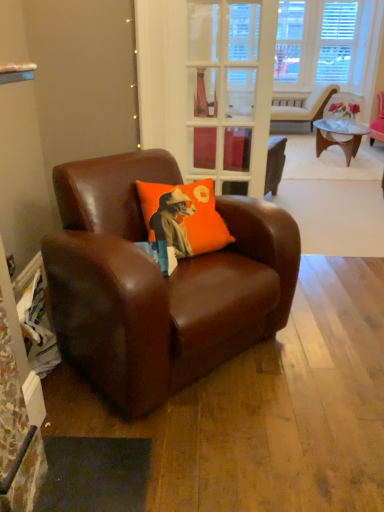
The width and height of the screenshot is (384, 512). What do you see at coordinates (303, 106) in the screenshot? I see `matte brown armchair at upper right, which appears as the first chair when viewed from the back` at bounding box center [303, 106].

The width and height of the screenshot is (384, 512). Describe the element at coordinates (158, 283) in the screenshot. I see `brown leather chair at left, arranged as the first chair when viewed from the left` at that location.

Image resolution: width=384 pixels, height=512 pixels. Find the location of `brown leather chair at left, which ranks as the first chair in bottom-to-top order`. brown leather chair at left, which ranks as the first chair in bottom-to-top order is located at coordinates (158, 283).

Find the location of a particular element. The image size is (384, 512). clear glass door at center is located at coordinates (230, 90).

The width and height of the screenshot is (384, 512). What are the coordinates of `matte brown armchair at upper right, the 2th chair viewed from the left` in the screenshot? It's located at (303, 106).

Identify the location of pillow that is on the left side of matte brown armchair at upper right, positioned as the 2th chair in front-to-back order. The height and width of the screenshot is (512, 384). (183, 217).

Between matte brown armchair at upper right, the 2th chair viewed from the left, and orange fabric pillow at center, which one has smaller size?

orange fabric pillow at center is smaller.

Can you confirm if matte brown armchair at upper right, which is counted as the first chair, starting from the top, is shorter than orange fabric pillow at center?

No, matte brown armchair at upper right, which is counted as the first chair, starting from the top, is not shorter than orange fabric pillow at center.

Can you tell me how much matte brown armchair at upper right, which is counted as the first chair, starting from the top, and orange fabric pillow at center differ in facing direction?

12.7 degrees.

Considering the sizes of brown leather chair at left, which is the second chair from right to left, and clear glass door at center in the image, is brown leather chair at left, which is the second chair from right to left, bigger or smaller than clear glass door at center?

In the image, brown leather chair at left, which is the second chair from right to left, appears to be larger than clear glass door at center.

From a real-world perspective, between brown leather chair at left, the second chair in the top-to-bottom sequence, and clear glass door at center, who is vertically lower?

brown leather chair at left, the second chair in the top-to-bottom sequence, from a real-world perspective.

What's the angular difference between brown leather chair at left, arranged as the first chair when viewed from the left, and clear glass door at center's facing directions?

They differ by 44.5 degrees in their facing directions.

From the picture: Is matte brown armchair at upper right, which is counted as the first chair, starting from the right, oriented away from clear glass door at center?

Answer: matte brown armchair at upper right, which is counted as the first chair, starting from the right, does not have its back to clear glass door at center.

From a real-world perspective, count 1st chairs downward from the clear glass door at center and point to it. Please provide its 2D coordinates.

[(303, 106)]

Based on the photo, which is in front, matte brown armchair at upper right, which is counted as the first chair, starting from the right, or clear glass door at center?

clear glass door at center is closer to the camera.

Does matte brown armchair at upper right, which is counted as the first chair, starting from the right, have a lesser height compared to clear glass door at center?

Correct, matte brown armchair at upper right, which is counted as the first chair, starting from the right, is not as tall as clear glass door at center.

Choose the correct answer: Is orange fabric pillow at center inside clear glass door at center or outside it?

orange fabric pillow at center is spatially situated outside clear glass door at center.

From a real-world perspective, is orange fabric pillow at center positioned above or below clear glass door at center?

From a real-world perspective, orange fabric pillow at center is physically below clear glass door at center.

From the image's perspective, does orange fabric pillow at center appear higher than clear glass door at center?

No, from the image's perspective, orange fabric pillow at center is not over clear glass door at center.

Is point (168, 214) positioned in front of point (285, 104)?

Yes, point (168, 214) is closer to viewer.

How far apart are orange fabric pillow at center and matte brown armchair at upper right, the second chair positioned from the bottom?

4.26 meters.

Based on their sizes in the image, would you say orange fabric pillow at center is bigger or smaller than matte brown armchair at upper right, which is counted as the first chair, starting from the right?

Considering their sizes, orange fabric pillow at center takes up less space than matte brown armchair at upper right, which is counted as the first chair, starting from the right.

What are the coordinates of `pillow below the matte brown armchair at upper right, which appears as the first chair when viewed from the back (from the image's perspective)` in the screenshot? It's located at (183, 217).

From the image's perspective, is matte brown armchair at upper right, positioned as the 2th chair in front-to-back order, located above or below brown leather chair at left, the second chair in the top-to-bottom sequence?

matte brown armchair at upper right, positioned as the 2th chair in front-to-back order, is above brown leather chair at left, the second chair in the top-to-bottom sequence.

Based on the photo, considering the sizes of objects matte brown armchair at upper right, the second chair positioned from the bottom, and brown leather chair at left, the 1th chair viewed from the front, in the image provided, who is bigger, matte brown armchair at upper right, the second chair positioned from the bottom, or brown leather chair at left, the 1th chair viewed from the front,?

brown leather chair at left, the 1th chair viewed from the front, is bigger.

Which object is wider, matte brown armchair at upper right, which is counted as the first chair, starting from the top, or brown leather chair at left, marked as the 2th chair in a back-to-front arrangement?

brown leather chair at left, marked as the 2th chair in a back-to-front arrangement.

Is matte brown armchair at upper right, which is counted as the first chair, starting from the top, far away from brown leather chair at left, which is the second chair from right to left?

That's right, there is a large distance between matte brown armchair at upper right, which is counted as the first chair, starting from the top, and brown leather chair at left, which is the second chair from right to left.

Considering the relative sizes of brown leather chair at left, which ranks as the first chair in bottom-to-top order, and orange fabric pillow at center in the image provided, is brown leather chair at left, which ranks as the first chair in bottom-to-top order, smaller than orange fabric pillow at center?

No.

Is point (149, 275) behind point (208, 197)?

That is False.

Considering the sizes of objects brown leather chair at left, the 1th chair viewed from the front, and orange fabric pillow at center in the image provided, who is taller, brown leather chair at left, the 1th chair viewed from the front, or orange fabric pillow at center?

brown leather chair at left, the 1th chair viewed from the front, is taller.

From the image's perspective, does brown leather chair at left, arranged as the first chair when viewed from the left, appear lower than orange fabric pillow at center?

Correct, brown leather chair at left, arranged as the first chair when viewed from the left, appears lower than orange fabric pillow at center in the image.

Locate an element on the screen. Image resolution: width=384 pixels, height=512 pixels. chair that appears above the orange fabric pillow at center (from the image's perspective) is located at coordinates (303, 106).

Locate an element on the screen. This screenshot has height=512, width=384. chair on the left of the clear glass door at center is located at coordinates (158, 283).

From the image, which object appears to be nearer to clear glass door at center, orange fabric pillow at center or brown leather chair at left, arranged as the first chair when viewed from the left?

orange fabric pillow at center.

Estimate the real-world distances between objects in this image. Which object is further from matte brown armchair at upper right, which appears as the first chair when viewed from the back, clear glass door at center or orange fabric pillow at center?

orange fabric pillow at center is further to matte brown armchair at upper right, which appears as the first chair when viewed from the back.

Looking at the image, which one is located closer to orange fabric pillow at center, clear glass door at center or matte brown armchair at upper right, which is counted as the first chair, starting from the right?

clear glass door at center.

Considering their positions, is brown leather chair at left, marked as the 2th chair in a back-to-front arrangement, positioned further to clear glass door at center than orange fabric pillow at center?

brown leather chair at left, marked as the 2th chair in a back-to-front arrangement, is further to clear glass door at center.

When comparing their distances from matte brown armchair at upper right, the 2th chair viewed from the left, does orange fabric pillow at center or brown leather chair at left, arranged as the first chair when viewed from the left, seem closer?

orange fabric pillow at center.

Considering their positions, is brown leather chair at left, which is the second chair from right to left, positioned further to orange fabric pillow at center than matte brown armchair at upper right, the 2th chair viewed from the left?

Based on the image, matte brown armchair at upper right, the 2th chair viewed from the left, appears to be further to orange fabric pillow at center.

Looking at the image, which one is located closer to clear glass door at center, orange fabric pillow at center or matte brown armchair at upper right, positioned as the 2th chair in front-to-back order?

orange fabric pillow at center is closer to clear glass door at center.

In the scene shown: Considering their positions, is matte brown armchair at upper right, which is counted as the first chair, starting from the top, positioned closer to clear glass door at center than brown leather chair at left, marked as the 2th chair in a back-to-front arrangement?

brown leather chair at left, marked as the 2th chair in a back-to-front arrangement, lies closer to clear glass door at center than the other object.

I want to click on glass door between brown leather chair at left, the 1th chair viewed from the front, and matte brown armchair at upper right, which appears as the first chair when viewed from the back, along the z-axis, so click(230, 90).

You are a GUI agent. You are given a task and a screenshot of the screen. Output one action in this format:
    pyautogui.click(x=<x>, y=<y>)
    Task: Click on the pillow located between brown leather chair at left, which is the second chair from right to left, and matte brown armchair at upper right, which is counted as the first chair, starting from the top, in the depth direction
    Image resolution: width=384 pixels, height=512 pixels.
    Given the screenshot: What is the action you would take?
    pyautogui.click(x=183, y=217)

The width and height of the screenshot is (384, 512). Find the location of `pillow between brown leather chair at left, the 1th chair viewed from the front, and clear glass door at center, along the z-axis`. pillow between brown leather chair at left, the 1th chair viewed from the front, and clear glass door at center, along the z-axis is located at coordinates (183, 217).

Find the location of `glass door between orange fabric pillow at center and matte brown armchair at upper right, which is counted as the first chair, starting from the right, along the z-axis`. glass door between orange fabric pillow at center and matte brown armchair at upper right, which is counted as the first chair, starting from the right, along the z-axis is located at coordinates coord(230,90).